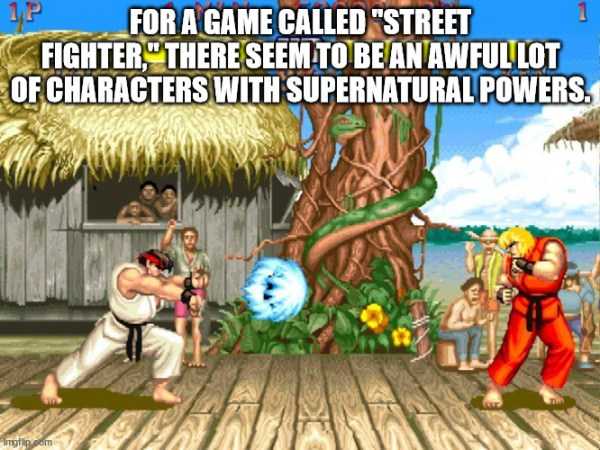
In order to click on floor in this screenshot , I will do `click(322, 385)`.